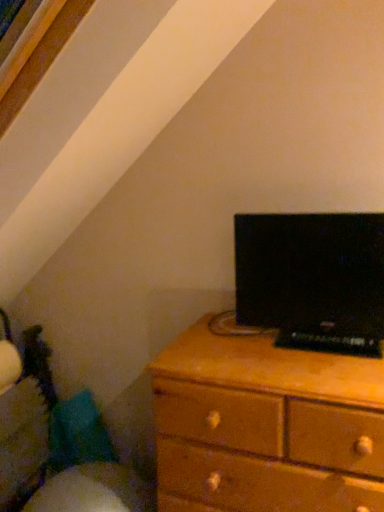
Question: Considering the relative sizes of black glossy monitor at upper right and wooden chest of drawers at lower right in the image provided, is black glossy monitor at upper right shorter than wooden chest of drawers at lower right?

Choices:
 (A) no
 (B) yes

Answer: (B)

Question: Does black glossy monitor at upper right have a lesser width compared to wooden chest of drawers at lower right?

Choices:
 (A) yes
 (B) no

Answer: (A)

Question: Does black glossy monitor at upper right have a smaller size compared to wooden chest of drawers at lower right?

Choices:
 (A) no
 (B) yes

Answer: (B)

Question: Would you say black glossy monitor at upper right is outside wooden chest of drawers at lower right?

Choices:
 (A) yes
 (B) no

Answer: (A)

Question: From a real-world perspective, does black glossy monitor at upper right stand above wooden chest of drawers at lower right?

Choices:
 (A) no
 (B) yes

Answer: (B)

Question: Is black glossy monitor at upper right further to the viewer compared to wooden chest of drawers at lower right?

Choices:
 (A) yes
 (B) no

Answer: (A)

Question: From a real-world perspective, is wooden chest of drawers at lower right below black glossy monitor at upper right?

Choices:
 (A) yes
 (B) no

Answer: (A)

Question: Is wooden chest of drawers at lower right further to camera compared to black glossy monitor at upper right?

Choices:
 (A) no
 (B) yes

Answer: (A)

Question: Could you tell me if wooden chest of drawers at lower right is turned towards black glossy monitor at upper right?

Choices:
 (A) no
 (B) yes

Answer: (A)

Question: Considering the relative sizes of wooden chest of drawers at lower right and black glossy monitor at upper right in the image provided, is wooden chest of drawers at lower right smaller than black glossy monitor at upper right?

Choices:
 (A) yes
 (B) no

Answer: (B)

Question: Considering the relative positions of wooden chest of drawers at lower right and black glossy monitor at upper right in the image provided, is wooden chest of drawers at lower right to the right of black glossy monitor at upper right from the viewer's perspective?

Choices:
 (A) yes
 (B) no

Answer: (B)

Question: Does wooden chest of drawers at lower right have a larger size compared to black glossy monitor at upper right?

Choices:
 (A) no
 (B) yes

Answer: (B)

Question: From a real-world perspective, is wooden chest of drawers at lower right positioned above or below black glossy monitor at upper right?

Choices:
 (A) below
 (B) above

Answer: (A)